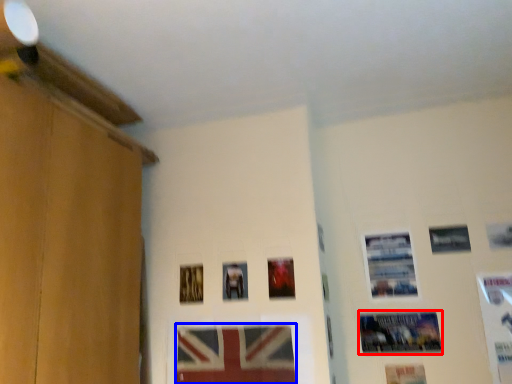
Question: Among these objects, which one is farthest to the camera, picture frame (highlighted by a red box) or picture frame (highlighted by a blue box)?

Choices:
 (A) picture frame
 (B) picture frame

Answer: (A)